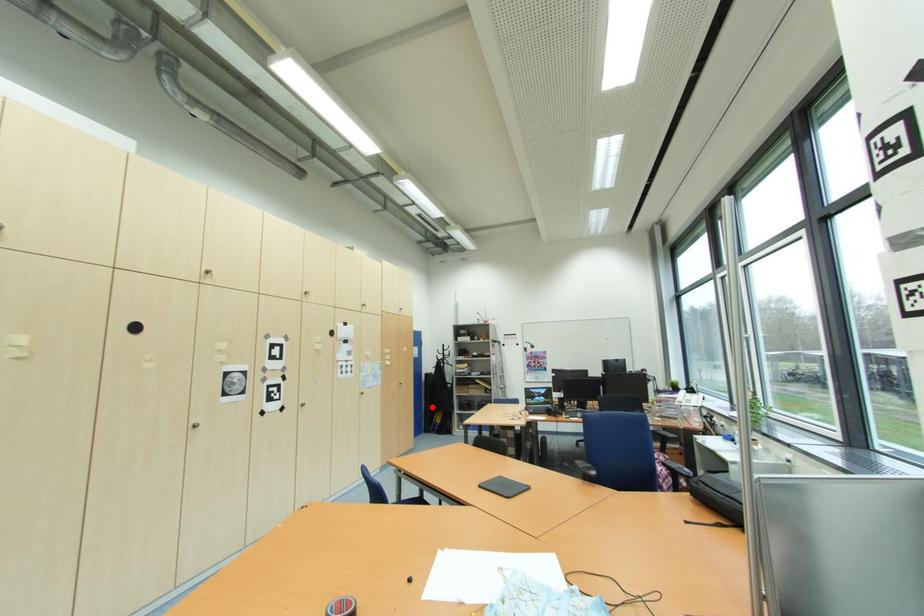
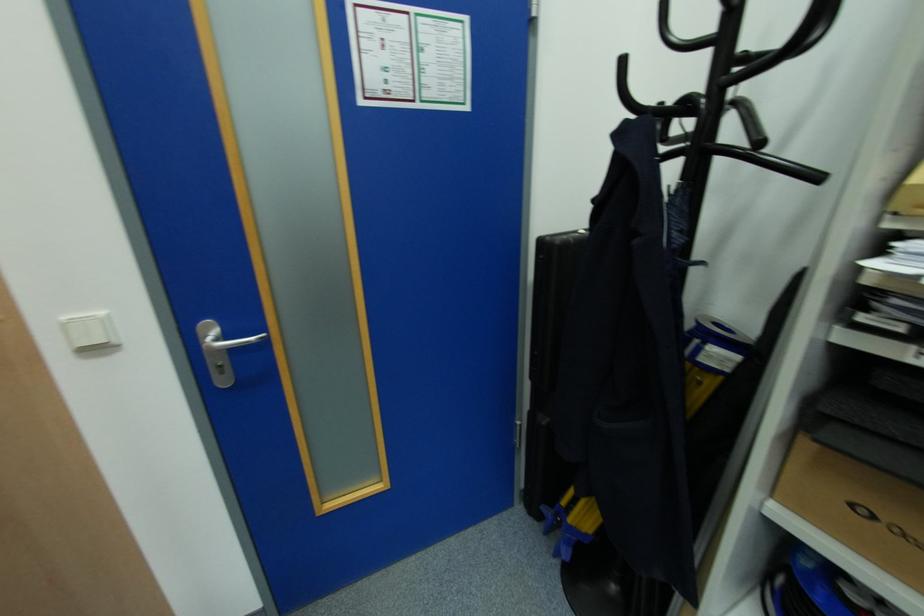
The point at the highlighted location is marked in the first image. Where is the corresponding point in the second image?

(548, 421)